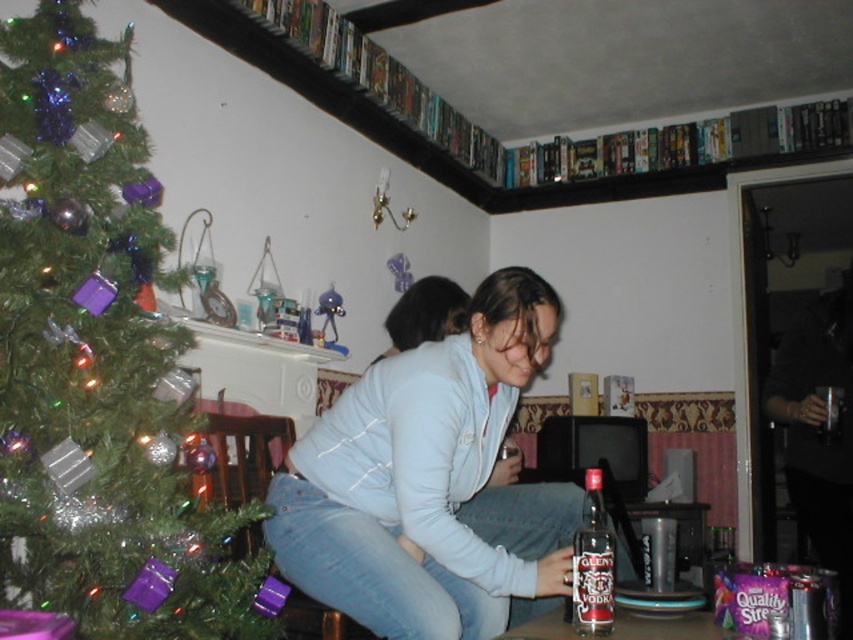
Can you confirm if green matte christmas tree at left is positioned to the left of clear glass bottle of glenlivet vodka at lower center?

Yes, green matte christmas tree at left is to the left of clear glass bottle of glenlivet vodka at lower center.

Is point (51, 144) positioned in front of point (582, 620)?

No, it is behind (582, 620).

This screenshot has height=640, width=853. What do you see at coordinates (97, 362) in the screenshot? I see `green matte christmas tree at left` at bounding box center [97, 362].

Where is `green matte christmas tree at left`? green matte christmas tree at left is located at coordinates (97, 362).

Looking at this image, is green matte christmas tree at left above light blue denim jeans at center?

Yes.

The width and height of the screenshot is (853, 640). I want to click on green matte christmas tree at left, so click(x=97, y=362).

Does light blue denim jeans at center have a greater width compared to clear glass bottle of glenlivet vodka at lower center?

Correct, the width of light blue denim jeans at center exceeds that of clear glass bottle of glenlivet vodka at lower center.

Between light blue denim jeans at center and clear glass bottle of glenlivet vodka at lower center, which one has more height?

light blue denim jeans at center is taller.

The image size is (853, 640). What do you see at coordinates (430, 483) in the screenshot?
I see `light blue denim jeans at center` at bounding box center [430, 483].

I want to click on light blue denim jeans at center, so click(430, 483).